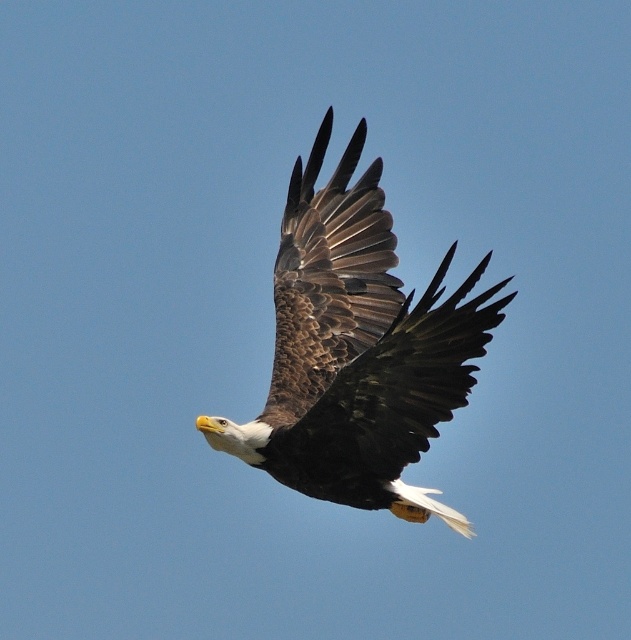
Based on the photo, between brown feathered eagle at center and brown textured wing at center, which one has less height?

brown textured wing at center is shorter.

Between brown feathered eagle at center and brown textured wing at center, which one appears on the left side from the viewer's perspective?

From the viewer's perspective, brown textured wing at center appears more on the left side.

Between point (427, 492) and point (327, 467), which one is positioned in front?

Point (327, 467) is in front.

Locate an element on the screen. brown feathered eagle at center is located at coordinates (357, 349).

Can you confirm if brown textured wing at center is taller than brown feathered wing at center?

Incorrect, brown textured wing at center's height is not larger of brown feathered wing at center's.

Which is behind, point (505, 280) or point (304, 344)?

Positioned behind is point (505, 280).

Where is `brown textured wing at center`? This screenshot has width=631, height=640. brown textured wing at center is located at coordinates (391, 394).

Does brown feathered eagle at center appear on the left side of brown feathered wing at center?

No, brown feathered eagle at center is not to the left of brown feathered wing at center.

Which is above, brown feathered eagle at center or brown feathered wing at center?

brown feathered wing at center

Describe the element at coordinates (357, 349) in the screenshot. The width and height of the screenshot is (631, 640). I see `brown feathered eagle at center` at that location.

At what (x,y) coordinates should I click in order to perform the action: click on brown feathered eagle at center. Please return your answer as a coordinate pair (x, y). The height and width of the screenshot is (640, 631). Looking at the image, I should click on (357, 349).